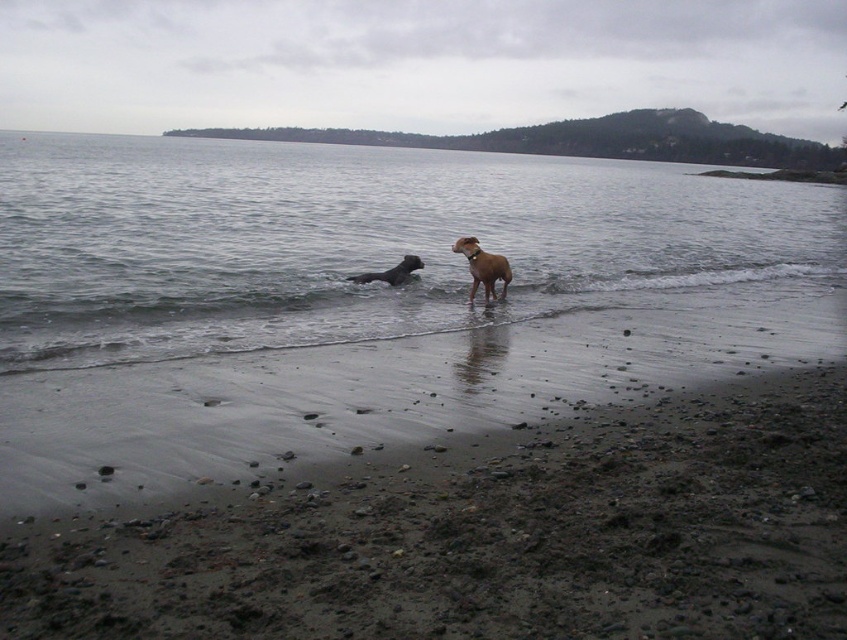
You are standing at the point marked by the coordinates point [363,241] in the beach scene. What can you see directly in front of you?

At point [363,241], you can see clear water at center directly in front of you.

You are a photographer trying to capture both dogs in the scene. Since the brown furry dog at center is larger than the shiny black dog at center, which dog should you move closer to ensure both appear proportionally sized in your photo?

To make both dogs appear proportionally sized in the photo, you should move closer to the shiny black dog at center since it is smaller than the brown furry dog at center.